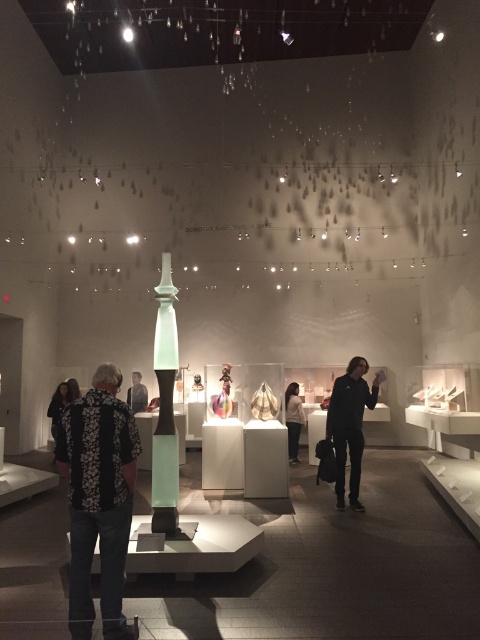
Locate an element on the screen. translucent glass column at center is located at coordinates (165, 406).

Between translucent glass column at center and white matte jacket at center, which one appears on the right side from the viewer's perspective?

white matte jacket at center

Between point (175, 502) and point (301, 420), which one is positioned behind?

Point (301, 420)

Find the location of a particular element. This screenshot has height=640, width=480. translucent glass column at center is located at coordinates (165, 406).

Does point (339, 467) come closer to viewer compared to point (133, 397)?

Yes, it is.

Does black matte jacket at center appear over dark gray sweater at center?

Indeed, black matte jacket at center is positioned over dark gray sweater at center.

Which is in front, point (345, 426) or point (133, 412)?

Positioned in front is point (345, 426).

Locate an element on the screen. Image resolution: width=480 pixels, height=640 pixels. black matte jacket at center is located at coordinates (349, 426).

Does translucent glass column at center appear on the left side of black textured jacket at left?

No, translucent glass column at center is not to the left of black textured jacket at left.

The height and width of the screenshot is (640, 480). What do you see at coordinates (165, 406) in the screenshot?
I see `translucent glass column at center` at bounding box center [165, 406].

The height and width of the screenshot is (640, 480). I want to click on translucent glass column at center, so click(165, 406).